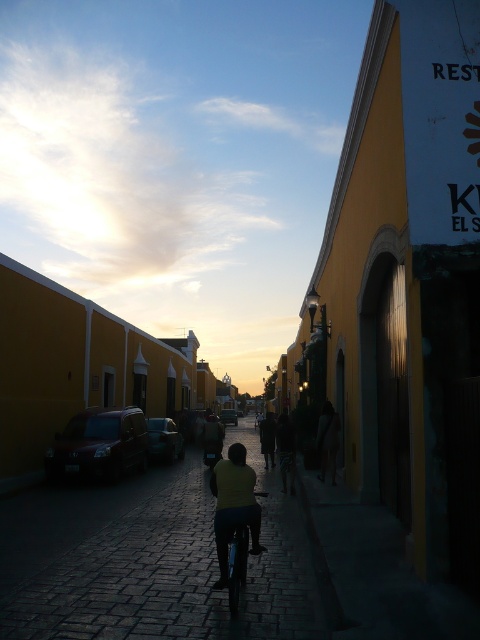
You are a delivery person standing on the cobblestone road in the street scene. You need to deliver a package to someone wearing a dark yellow shirt at center and carrying a dark fabric bag at center. Which item should you approach first to find the recipient?

The dark yellow shirt at center is positioned on the left side of dark fabric bag at center, so you should approach the dark yellow shirt at center first since it is closer to your left side.

You are a delivery person carrying a dark fabric bag at center and need to enter a dark cobblestone alley at center. Given that the alley is 3.41 meters away from the bag, can you safely walk from your current position to the entrance of the alley without needing to move the bag?

The dark cobblestone alley at center is 3.41 meters away from the dark fabric bag at center. Since the distance is sufficient, you can safely walk to the alley entrance without moving the bag.